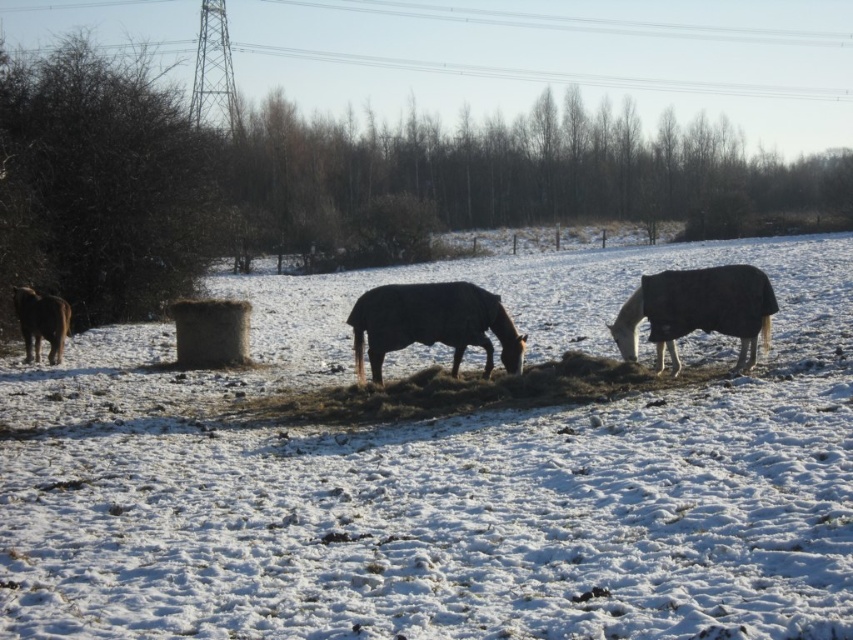
Question: Which object is farther from the camera taking this photo?

Choices:
 (A) brown matte horse at center
 (B) black glossy horse at right
 (C) brown furry horse at left
 (D) white fluffy snow at center

Answer: (C)

Question: Can you confirm if black glossy horse at right is smaller than brown furry horse at left?

Choices:
 (A) yes
 (B) no

Answer: (B)

Question: Does black glossy horse at right appear on the left side of brown furry horse at left?

Choices:
 (A) no
 (B) yes

Answer: (A)

Question: Which object appears farthest from the camera in this image?

Choices:
 (A) brown matte horse at center
 (B) brown furry horse at left

Answer: (B)

Question: Which object is positioned closest to the brown matte horse at center?

Choices:
 (A) brown furry horse at left
 (B) black glossy horse at right

Answer: (B)

Question: Does white fluffy snow at center have a greater width compared to brown matte horse at center?

Choices:
 (A) yes
 (B) no

Answer: (A)